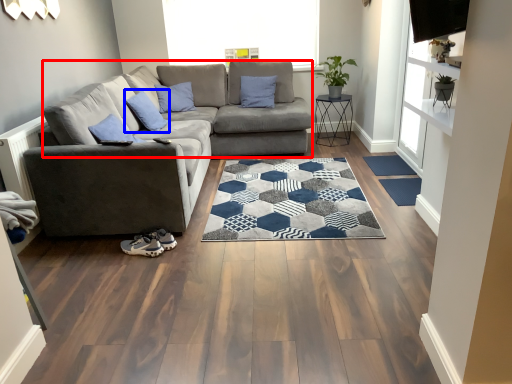
Question: Which point is further to the camera, couch (highlighted by a red box) or pillow (highlighted by a blue box)?

Choices:
 (A) couch
 (B) pillow

Answer: (A)